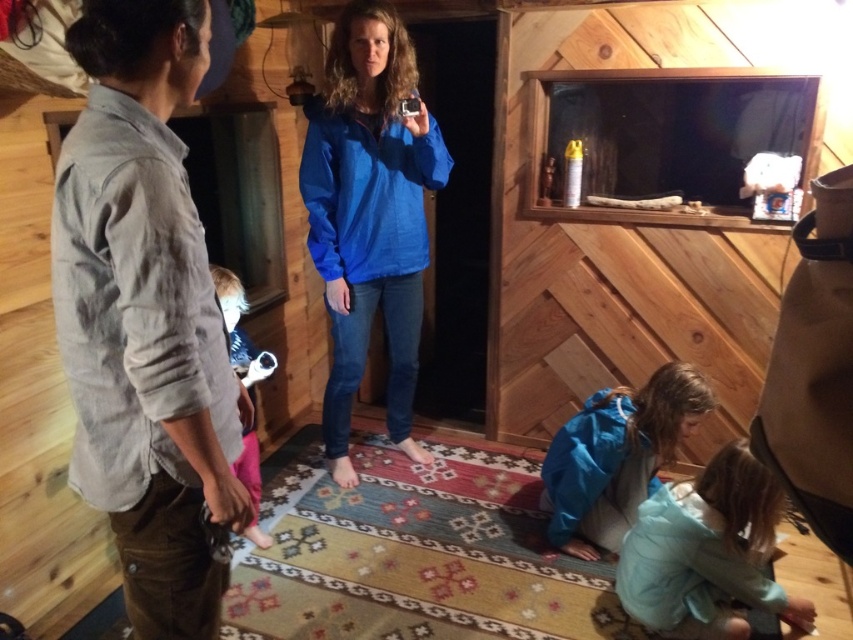
Based on the photo, you are organizing a photo shoot in this cabin and need to ensure that all props fit on a table. The table can only accommodate items that are smaller than the blue matte jacket at center. Can the pink fabric at lower left be placed on the table?

The blue matte jacket at center is bigger than the pink fabric at lower left, so yes, the pink fabric at lower left can be placed on the table since it is smaller than the blue matte jacket at center.

You are standing in the wooden cabin and want to locate the gray cotton shirt at left. According to the coordinates provided, where would you look relative to the center of the image?

The gray cotton shirt at left is located at point 0.495 on the x axis and 0.171 on the y axis, which is slightly to the right and just below the center of the image.